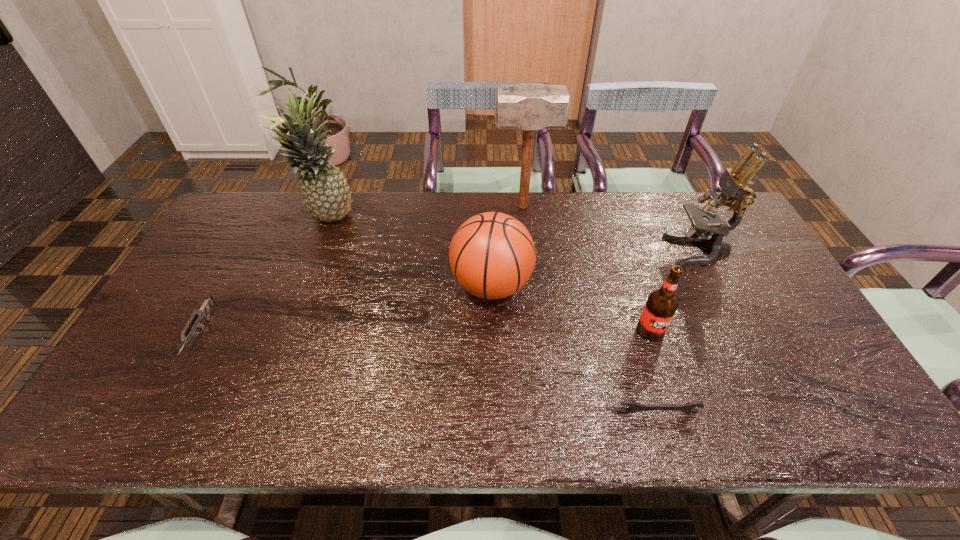
Find the location of a particular element. Image resolution: width=960 pixels, height=540 pixels. empty space between the wrench and the mallet is located at coordinates (589, 309).

The height and width of the screenshot is (540, 960). I want to click on vacant area that lies between the mallet and the nearest object, so click(589, 309).

This screenshot has height=540, width=960. Identify the location of vacant area between the root beer and the shortest object. (654, 372).

Locate an element on the screen. The image size is (960, 540). vacant area that lies between the root beer and the basketball is located at coordinates (571, 308).

Find the location of a particular element. blank region between the shortest object and the mallet is located at coordinates (589, 309).

At what (x,y) coordinates should I click in order to perform the action: click on vacant area that lies between the mallet and the pineapple. Please return your answer as a coordinate pair (x, y). The height and width of the screenshot is (540, 960). Looking at the image, I should click on (424, 212).

Identify the location of empty space between the root beer and the shortest object. This screenshot has height=540, width=960. (654, 372).

The width and height of the screenshot is (960, 540). In order to click on vacant area that lies between the nearest object and the rightmost object in this screenshot , I will do `click(678, 332)`.

This screenshot has width=960, height=540. What are the coordinates of `free space that is in between the sixth tallest object and the root beer` in the screenshot? It's located at (425, 333).

Choose which object is the nearest neighbor to the wrench. Please provide its 2D coordinates. Your answer should be formatted as a tuple, i.e. [(x, y)], where the tuple contains the x and y coordinates of a point satisfying the conditions above.

[(661, 305)]